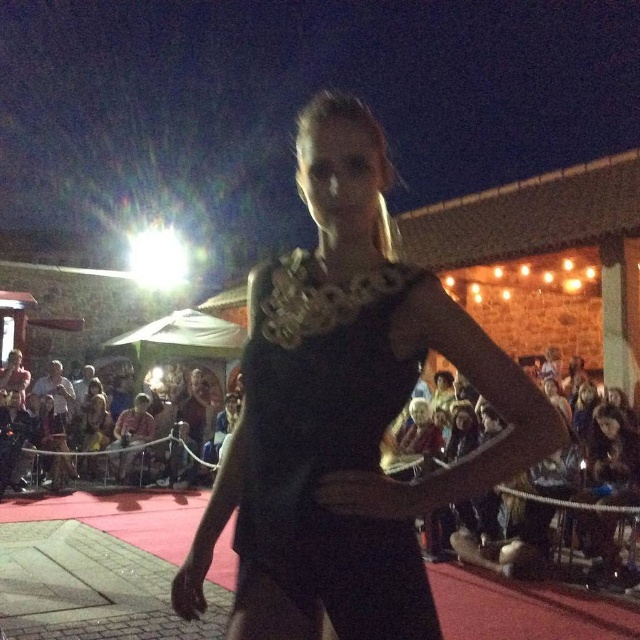
Does black matte dress at center have a larger size compared to black satin dress at center?

Yes, black matte dress at center is bigger than black satin dress at center.

Can you confirm if black matte dress at center is positioned to the left of black satin dress at center?

Incorrect, black matte dress at center is not on the left side of black satin dress at center.

Between point (349, 612) and point (381, 368), which one is positioned in front?

Point (381, 368)

Find the location of a particular element. black matte dress at center is located at coordinates (346, 413).

What do you see at coordinates (346, 413) in the screenshot? Image resolution: width=640 pixels, height=640 pixels. I see `black matte dress at center` at bounding box center [346, 413].

Is point (532, 440) farther from camera compared to point (134, 420)?

No, (532, 440) is in front of (134, 420).

Does point (468, 316) lie in front of point (147, 429)?

Yes, it is.

Image resolution: width=640 pixels, height=640 pixels. I want to click on black matte dress at center, so click(x=346, y=413).

Can you confirm if black satin dress at center is positioned to the right of light brown fabric hat at lower center?

Yes, black satin dress at center is to the right of light brown fabric hat at lower center.

Is black satin dress at center wider than light brown fabric hat at lower center?

Incorrect, black satin dress at center's width does not surpass light brown fabric hat at lower center's.

Who is more distant from viewer, (276, 332) or (141, 428)?

Point (141, 428)

At what (x,y) coordinates should I click in order to perform the action: click on black satin dress at center. Please return your answer as a coordinate pair (x, y). This screenshot has height=640, width=640. Looking at the image, I should click on (326, 448).